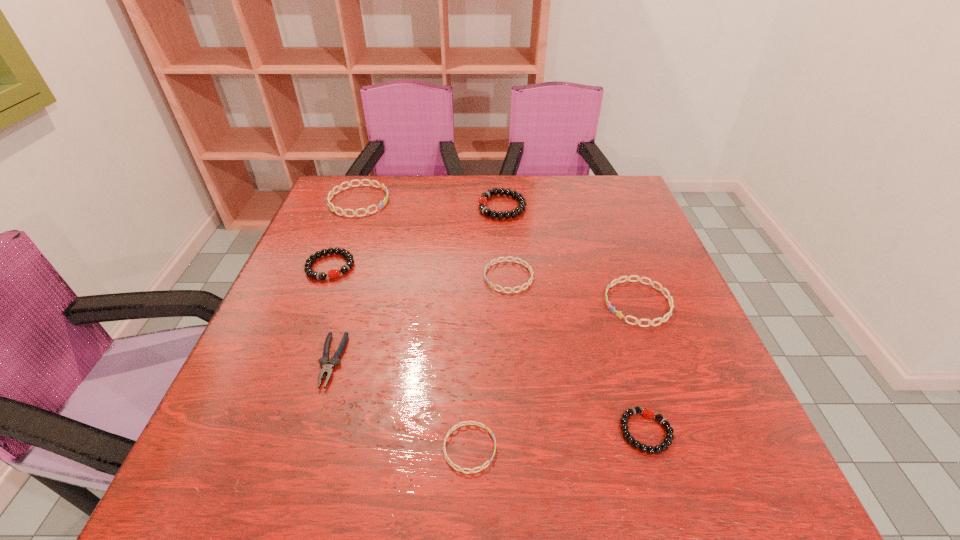
What are the coordinates of `blue bracelet identified as the third closest to the leftmost blue bracelet` in the screenshot? It's located at (456, 426).

Where is `the closest black bracelet to the second smallest blue bracelet`? The height and width of the screenshot is (540, 960). the closest black bracelet to the second smallest blue bracelet is located at coordinates (482, 202).

This screenshot has width=960, height=540. In order to click on black bracelet that is the closest to the leftmost black bracelet in this screenshot , I will do `click(482, 202)`.

Locate an element on the screen. vacant position in the image that satisfies the following two spatial constraints: 1. on the surface of the farthest black bracelet showing star-shaped elements; 2. on the right side of the leftmost blue bracelet is located at coordinates (357, 207).

Where is `vacant space that satisfies the following two spatial constraints: 1. at the gripping part of the rightmost black bracelet; 2. on the left side of the gray pliers`? This screenshot has width=960, height=540. vacant space that satisfies the following two spatial constraints: 1. at the gripping part of the rightmost black bracelet; 2. on the left side of the gray pliers is located at coordinates (310, 431).